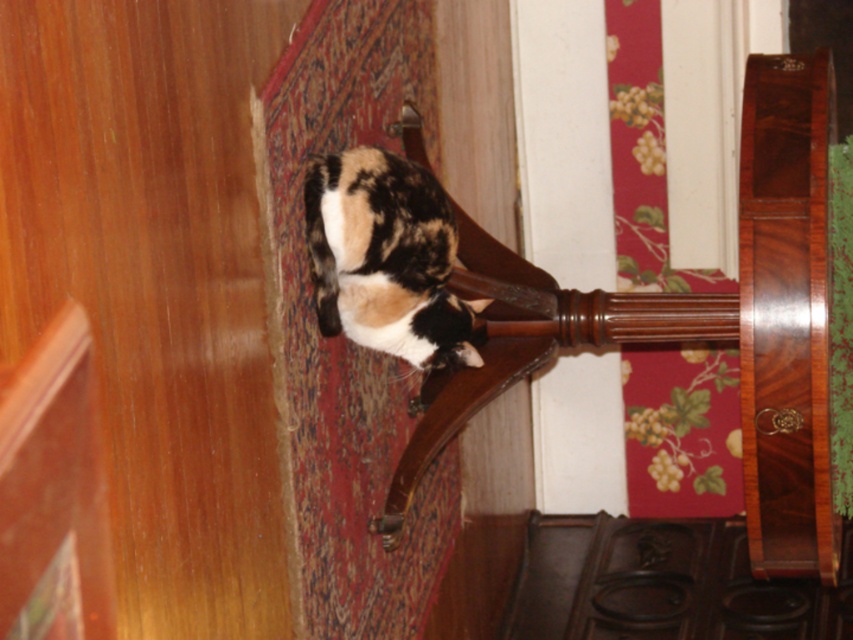
Question: Does shiny wood chair at center appear on the right side of calico fur cat at center?

Choices:
 (A) no
 (B) yes

Answer: (B)

Question: Which object appears closest to the camera in this image?

Choices:
 (A) shiny wood chair at center
 (B) calico fur cat at center

Answer: (A)

Question: Is shiny wood chair at center smaller than calico fur cat at center?

Choices:
 (A) no
 (B) yes

Answer: (A)

Question: Is shiny wood chair at center thinner than calico fur cat at center?

Choices:
 (A) yes
 (B) no

Answer: (A)

Question: Which point is farther from the camera taking this photo?

Choices:
 (A) (366, 176)
 (B) (767, 324)

Answer: (A)